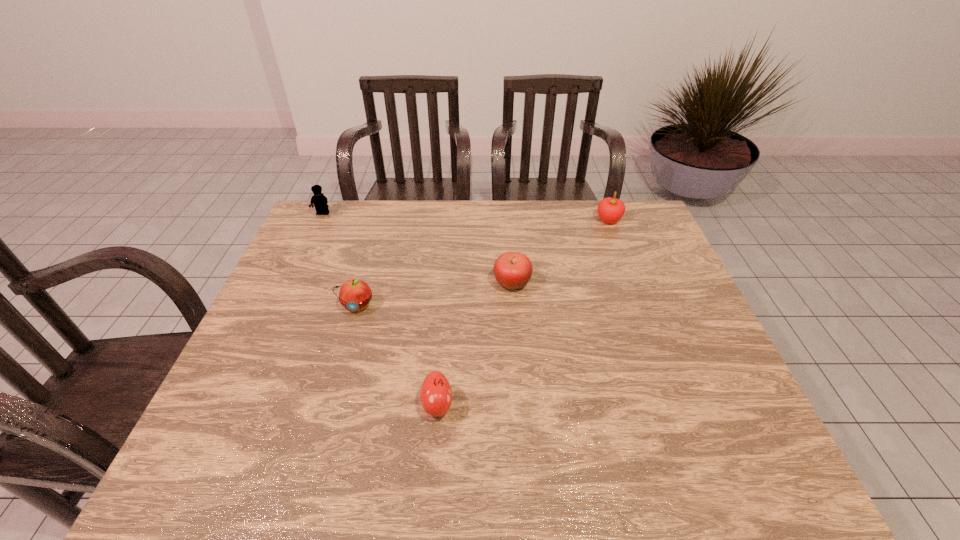
Locate an element on the screen. The image size is (960, 540). free space at the left edge is located at coordinates coord(247,397).

Identify the location of free space at the right edge of the desktop. (711, 415).

Identify the location of blank space at the near left corner of the desktop. The image size is (960, 540). (245, 462).

In the image, there is a desktop. Identify the location of blank space at the far right corner. (616, 225).

Locate an element on the screen. This screenshot has height=540, width=960. free space between the leftmost object and the second object from left to right is located at coordinates (340, 260).

You are a GUI agent. You are given a task and a screenshot of the screen. Output one action in this format:
    pyautogui.click(x=<x>, y=<y>)
    Task: Click on the vacant area that lies between the Lego and the rightmost object
    The image size is (960, 540).
    Given the screenshot: What is the action you would take?
    pyautogui.click(x=466, y=217)

Find the location of a particular element. vacant space that's between the Lego and the rightmost apple is located at coordinates (466, 217).

Where is `blank region between the second apple from left to right and the rightmost object`? This screenshot has width=960, height=540. blank region between the second apple from left to right and the rightmost object is located at coordinates (523, 313).

At what (x,y) coordinates should I click in order to perform the action: click on free space between the Lego and the farthest apple. Please return your answer as a coordinate pair (x, y). Image resolution: width=960 pixels, height=540 pixels. Looking at the image, I should click on (466, 217).

Locate an element on the screen. This screenshot has height=540, width=960. free space between the third object from left to right and the leftmost apple is located at coordinates (397, 355).